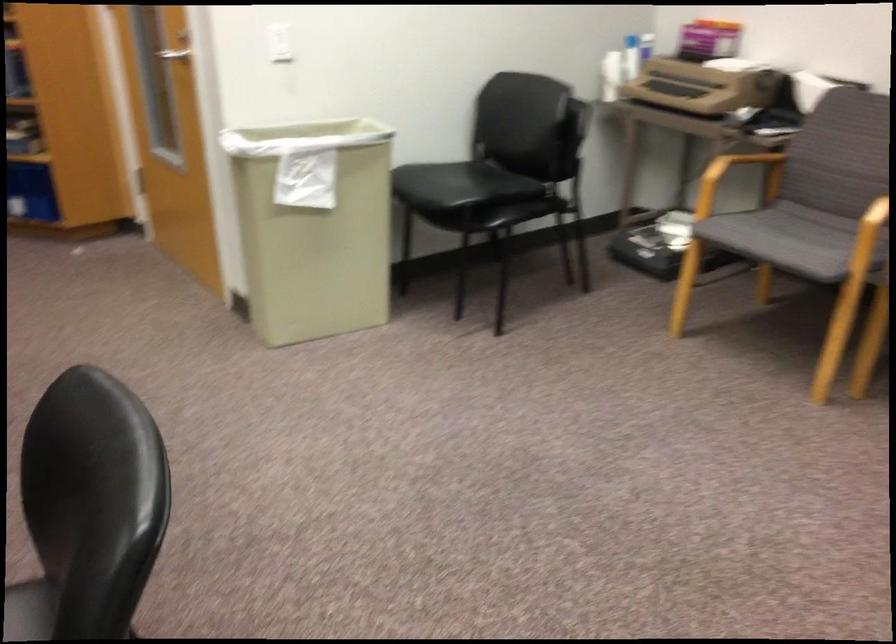
Image resolution: width=896 pixels, height=644 pixels. I want to click on black chair sitting surface, so click(x=468, y=182).